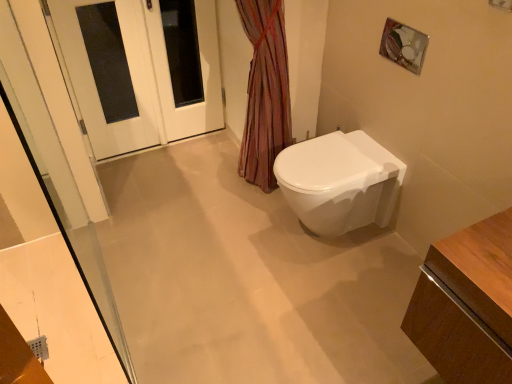
Identify the location of free space in front of white glossy toilet at center-right. (332, 292).